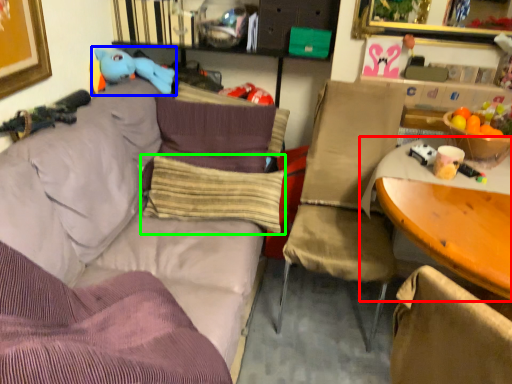
Question: Estimate the real-world distances between objects in this image. Which object is farther from table (highlighted by a red box), toy (highlighted by a blue box) or pillow (highlighted by a green box)?

Choices:
 (A) toy
 (B) pillow

Answer: (A)